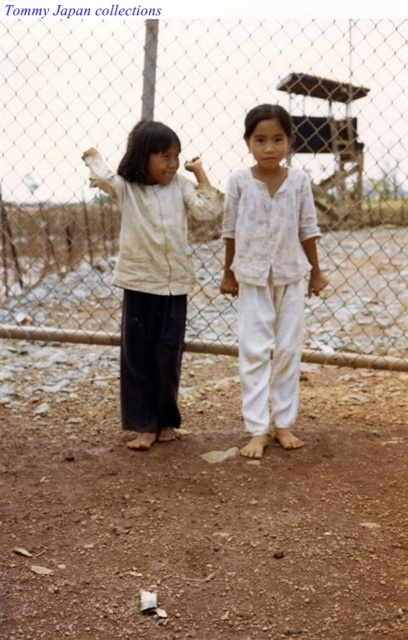
Which is above, brown dirt field at lower center or light beige cotton shirt at center?

light beige cotton shirt at center is higher up.

Is point (101, 410) closer to camera compared to point (148, 282)?

No, (101, 410) is further to viewer.

Locate an element on the screen. brown dirt field at lower center is located at coordinates (199, 508).

Measure the distance between white cotton pants at center and camera.

A distance of 14.18 feet exists between white cotton pants at center and camera.

Which is more to the right, white cotton pants at center or light beige cotton shirt at center?

white cotton pants at center is more to the right.

Where is `white cotton pants at center`? The image size is (408, 640). white cotton pants at center is located at coordinates (268, 275).

The image size is (408, 640). Identify the location of wire mesh fence at center. (204, 160).